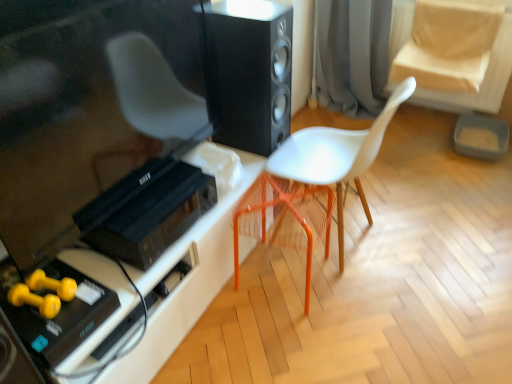
This screenshot has width=512, height=384. I want to click on free space between orange plastic swivel chair at center and white plastic table at lower left, so click(232, 335).